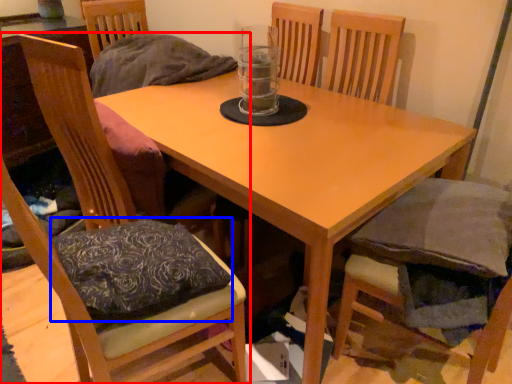
Question: Which object is further to the camera taking this photo, chair (highlighted by a red box) or pillow (highlighted by a blue box)?

Choices:
 (A) chair
 (B) pillow

Answer: (B)